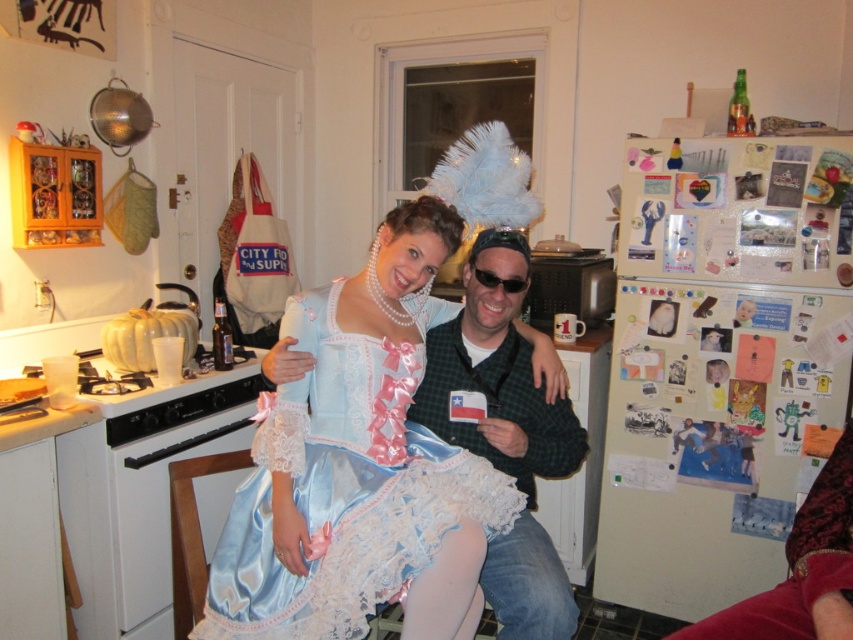
Is point (320, 384) more distant than point (529, 406)?

No, (320, 384) is closer to viewer.

Is point (341, 561) positioned before point (550, 618)?

Yes, it is.

Locate an element on the screen. satin blue dress at center is located at coordinates (344, 490).

Identify the location of satin blue dress at center. The height and width of the screenshot is (640, 853). (344, 490).

Is the position of satin blue dress at center less distant than that of black plastic sunglasses at center?

Yes, satin blue dress at center is closer to the viewer.

I want to click on satin blue dress at center, so click(x=344, y=490).

Describe the element at coordinates (506, 436) in the screenshot. I see `green plaid shirt at center` at that location.

How much distance is there between green plaid shirt at center and black plastic sunglasses at center?

green plaid shirt at center and black plastic sunglasses at center are 12.88 inches apart.

This screenshot has width=853, height=640. Find the location of `green plaid shirt at center`. green plaid shirt at center is located at coordinates (506, 436).